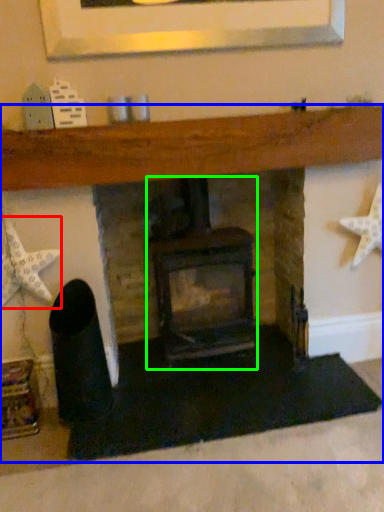
Question: Considering the real-world distances, which object is closest to starfish (highlighted by a red box)? fireplace (highlighted by a blue box) or wood burning stove (highlighted by a green box).

Choices:
 (A) fireplace
 (B) wood burning stove

Answer: (A)